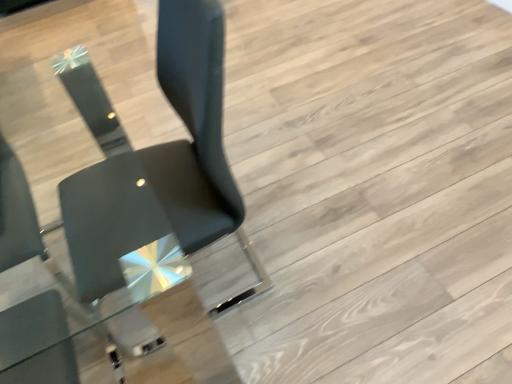
Question: Which direction should I rotate to look at matte black chair at center, the second chair in the left-to-right sequence?

Choices:
 (A) left
 (B) right

Answer: (A)

Question: Is matte black chair at lower left, which is the 1th chair in left-to-right order, beside matte black chair at center, the second chair in the left-to-right sequence?

Choices:
 (A) no
 (B) yes

Answer: (A)

Question: Is matte black chair at lower left, arranged as the second chair when viewed from the right, shorter than matte black chair at center, the 1th chair when ordered from right to left?

Choices:
 (A) yes
 (B) no

Answer: (A)

Question: Can you confirm if matte black chair at lower left, which is the 1th chair in left-to-right order, is positioned to the right of matte black chair at center, the second chair in the left-to-right sequence?

Choices:
 (A) no
 (B) yes

Answer: (A)

Question: Is matte black chair at lower left, arranged as the second chair when viewed from the right, further to the viewer compared to matte black chair at center, the 1th chair when ordered from right to left?

Choices:
 (A) yes
 (B) no

Answer: (A)

Question: From the image's perspective, is matte black chair at lower left, which is the 1th chair in left-to-right order, under matte black chair at center, the 1th chair when ordered from right to left?

Choices:
 (A) yes
 (B) no

Answer: (A)

Question: Is matte black chair at lower left, which is the 1th chair in left-to-right order, looking in the opposite direction of matte black chair at center, the second chair in the left-to-right sequence?

Choices:
 (A) no
 (B) yes

Answer: (A)

Question: From a real-world perspective, is matte black chair at center, the 1th chair when ordered from right to left, physically below matte black chair at lower left, which is the 1th chair in left-to-right order?

Choices:
 (A) no
 (B) yes

Answer: (A)

Question: Could you tell me if matte black chair at center, the 1th chair when ordered from right to left, is facing matte black chair at lower left, which is the 1th chair in left-to-right order?

Choices:
 (A) no
 (B) yes

Answer: (B)

Question: Is matte black chair at lower left, arranged as the second chair when viewed from the right, inside matte black chair at center, the second chair in the left-to-right sequence?

Choices:
 (A) yes
 (B) no

Answer: (B)

Question: Does matte black chair at center, the second chair in the left-to-right sequence, have a lesser height compared to matte black chair at lower left, which is the 1th chair in left-to-right order?

Choices:
 (A) no
 (B) yes

Answer: (A)

Question: From the image's perspective, does matte black chair at center, the second chair in the left-to-right sequence, appear higher than matte black chair at lower left, which is the 1th chair in left-to-right order?

Choices:
 (A) yes
 (B) no

Answer: (A)

Question: Can you see matte black chair at center, the second chair in the left-to-right sequence, touching matte black chair at lower left, arranged as the second chair when viewed from the right?

Choices:
 (A) yes
 (B) no

Answer: (B)

Question: From the image's perspective, is matte black chair at center, the 1th chair when ordered from right to left, above or below matte black chair at lower left, which is the 1th chair in left-to-right order?

Choices:
 (A) above
 (B) below

Answer: (A)